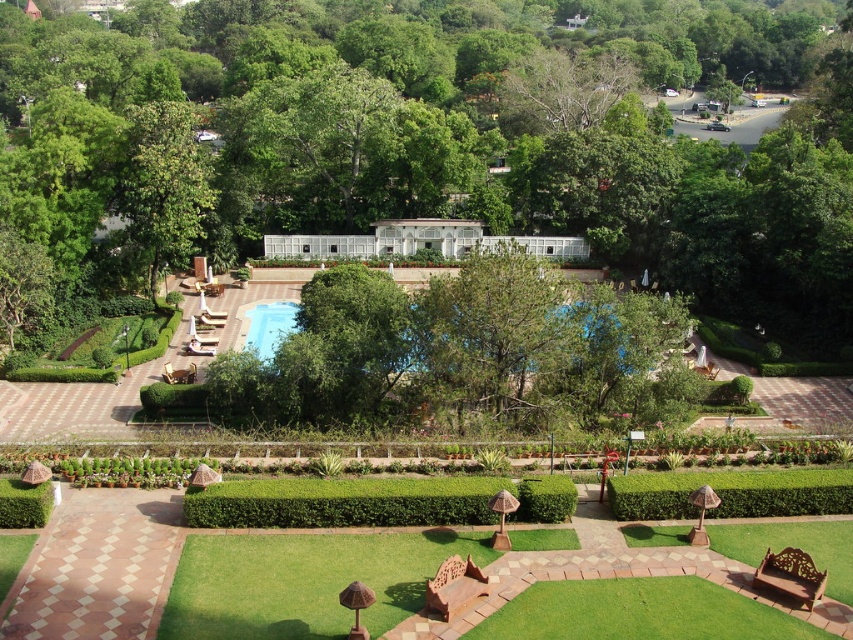
You are standing at the edge of the swimming pool and want to walk to the point marked as point [102,132]. However, you need to avoid stepping on the checkered walkway. Which direction should you move relative to the point [265,333] to reach your destination?

Since point [102,132] is closer to the camera than point [265,333], you should move towards the camera or in the direction that brings you closer to the camera relative to point [265,333] to avoid the walkway and reach the desired point.

You are planning to host a garden party and want to place a large tent that requires 10 square meters of space. Given the green leafy tree at center and the transparent glass pool at center, which object would you avoid placing the tent near to ensure enough space?

You should avoid placing the tent near the green leafy tree at center because it is larger in size than the transparent glass pool at center, so it occupies more space and may not leave enough room for the tent.